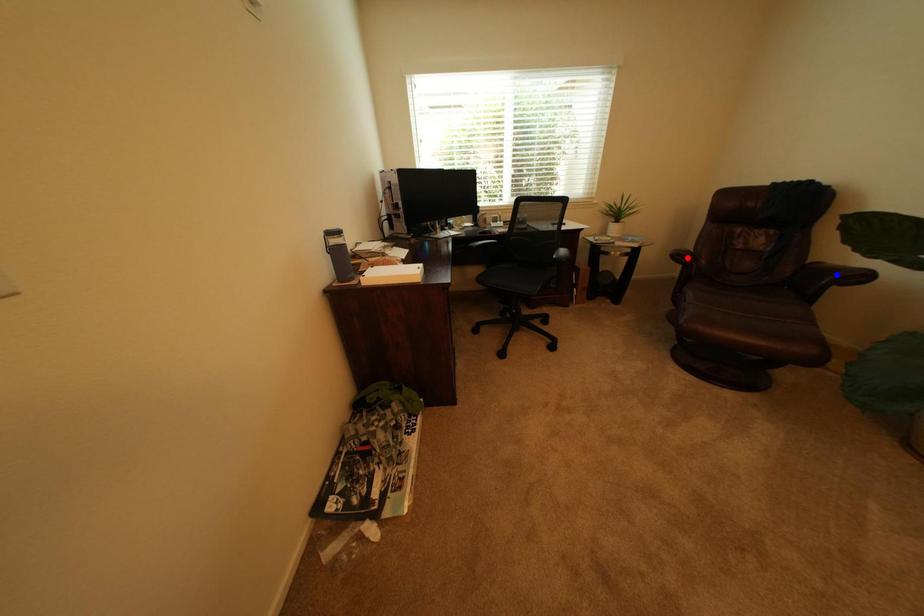
Question: Which of the two points in the image is closer to the camera?

Choices:
 (A) Blue point is closer.
 (B) Red point is closer.

Answer: (A)